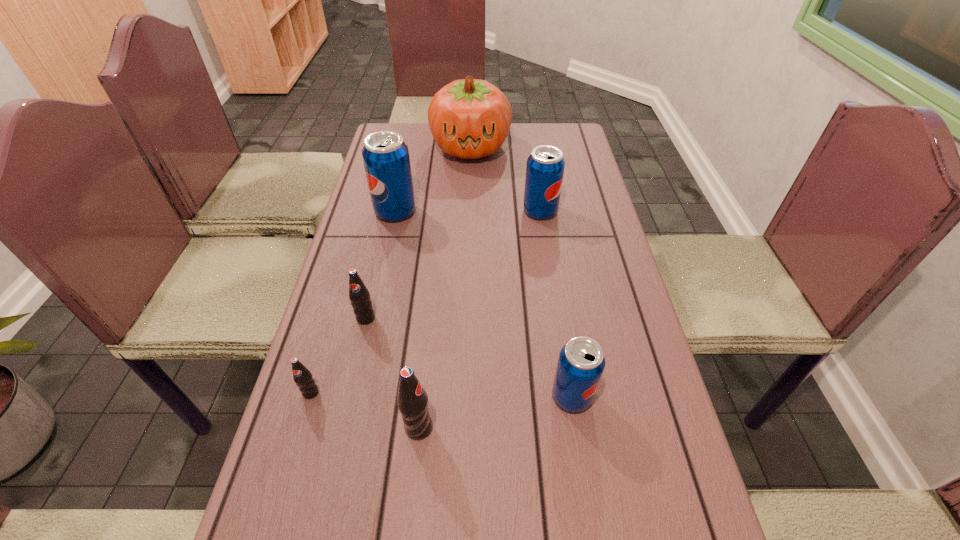
In the image, there is a desktop. Identify the location of free space at the left edge. This screenshot has height=540, width=960. (388, 316).

This screenshot has width=960, height=540. Identify the location of free space at the right edge of the desktop. (588, 308).

You are a GUI agent. You are given a task and a screenshot of the screen. Output one action in this format:
    pyautogui.click(x=<x>, y=<y>)
    Task: Click on the free spot at the far right corner of the desktop
    
    Given the screenshot: What is the action you would take?
    pyautogui.click(x=585, y=147)

Locate an element on the screen. This screenshot has width=960, height=540. vacant area that lies between the nearest blue pop soda and the leftmost pop is located at coordinates (442, 395).

The width and height of the screenshot is (960, 540). Find the location of `free area in between the second biggest black pop and the second biggest blue pop soda`. free area in between the second biggest black pop and the second biggest blue pop soda is located at coordinates (453, 265).

Locate an element on the screen. Image resolution: width=960 pixels, height=540 pixels. vacant area that lies between the nearest blue pop soda and the farthest object is located at coordinates (521, 272).

The image size is (960, 540). In order to click on vacant space that's between the second smallest blue pop soda and the smallest blue pop soda in this screenshot , I will do `click(556, 303)`.

This screenshot has width=960, height=540. I want to click on vacant space that is in between the fourth pop from left to right and the second biggest blue pop soda, so click(x=479, y=319).

You are a GUI agent. You are given a task and a screenshot of the screen. Output one action in this format:
    pyautogui.click(x=<x>, y=<y>)
    Task: Click on the vacant area between the farthest object and the leftmost black pop
    This screenshot has width=960, height=540.
    Given the screenshot: What is the action you would take?
    pyautogui.click(x=391, y=270)

I want to click on free spot between the farthest object and the third farthest pop, so click(419, 233).